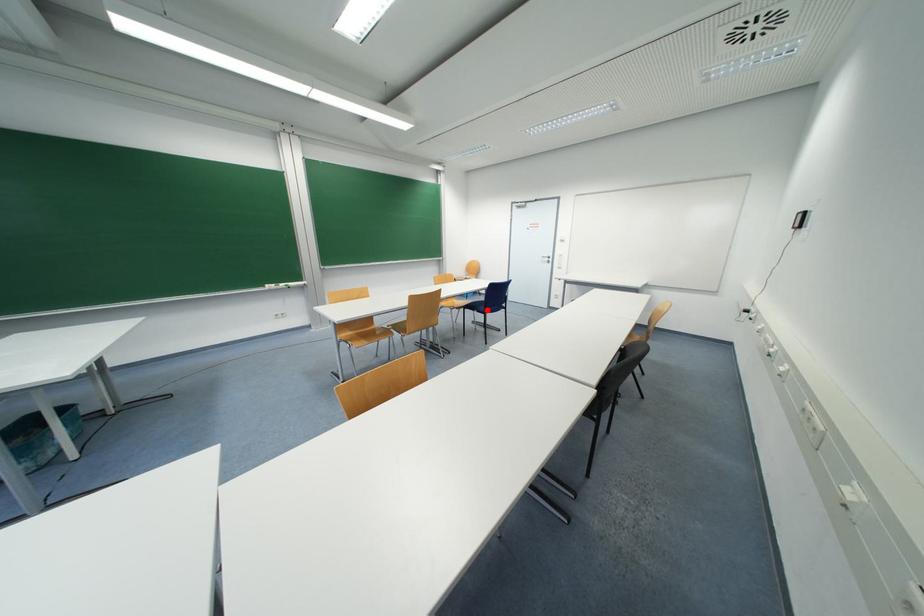
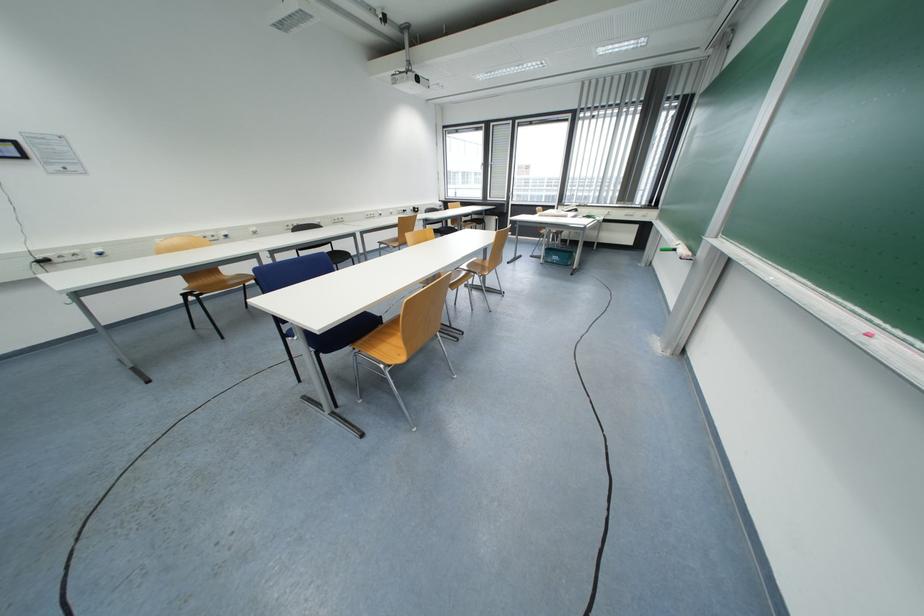
Question: I am providing you with two images of the same scene from different viewpoints. A red point is marked on the first image. Can you still see the location of the red point in image 2?

Choices:
 (A) Yes
 (B) No

Answer: (B)